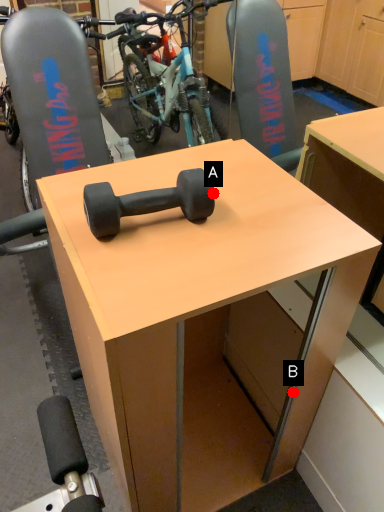
Question: Two points are circled on the image, labeled by A and B beside each circle. Which of the following is the farthest from the observer?

Choices:
 (A) A is further
 (B) B is further

Answer: (B)